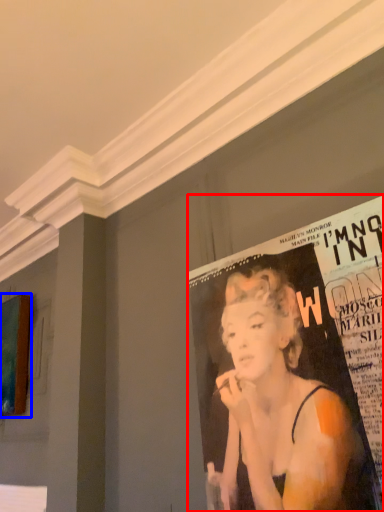
Question: Which object appears closest to the camera in this image, poster (highlighted by a red box) or advertisement (highlighted by a blue box)?

Choices:
 (A) poster
 (B) advertisement

Answer: (A)